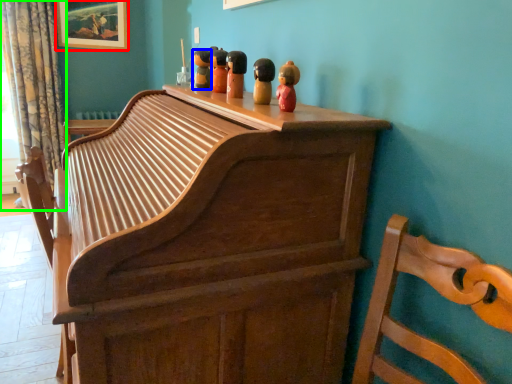
Question: Which object is positioned closest to picture frame (highlighted by a red box)? Select from toy (highlighted by a blue box) and curtain (highlighted by a green box).

Choices:
 (A) toy
 (B) curtain

Answer: (B)